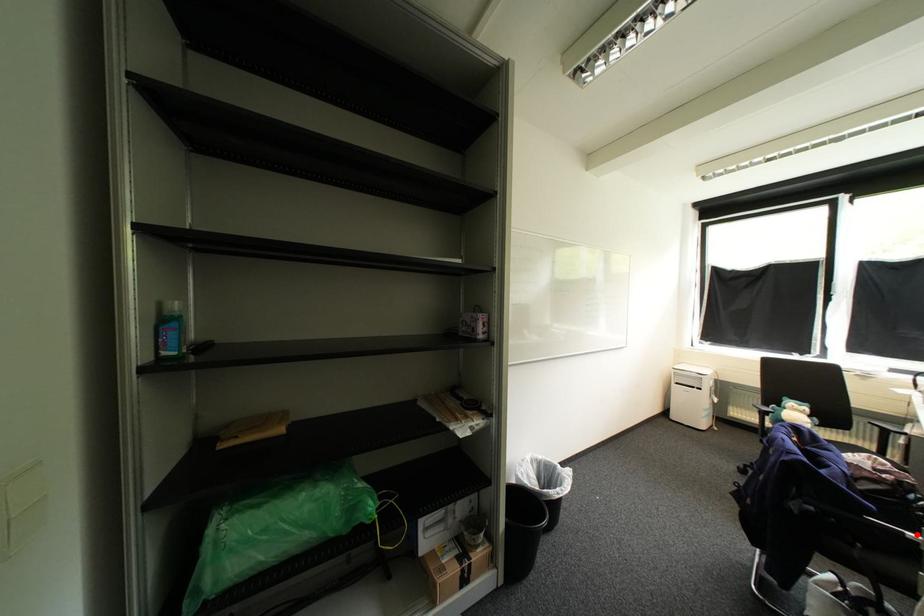
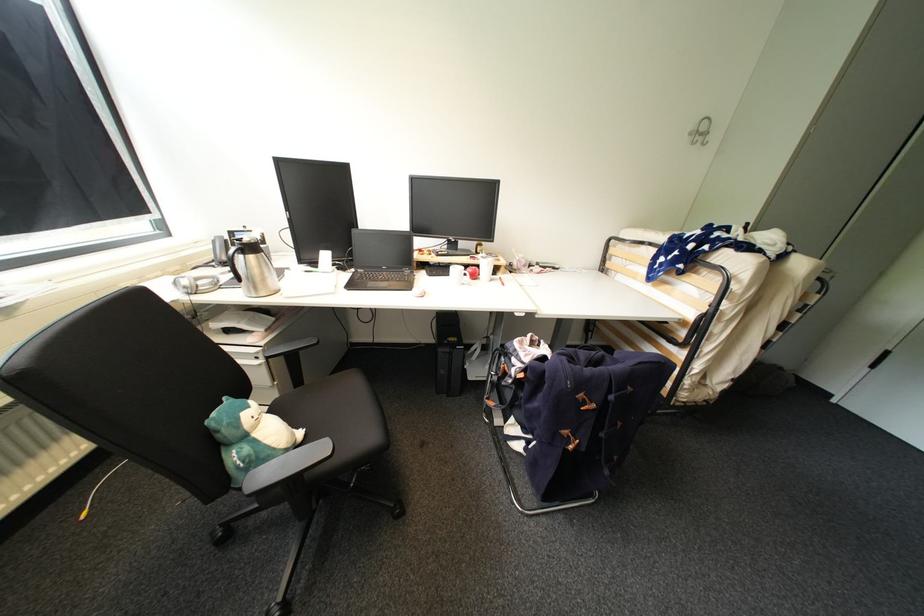
Question: I am providing you with two images of the same scene from different viewpoints. A red point is marked on the first image. Can you still see the location of the red point in image 2?

Choices:
 (A) Yes
 (B) No

Answer: (B)